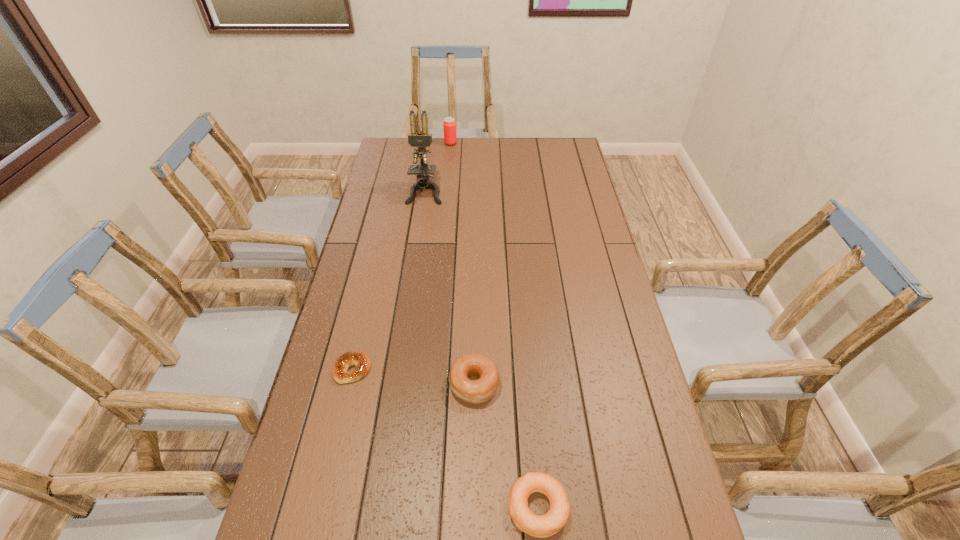
At what (x,y) coordinates should I click in order to perform the action: click on free point between the fourth nearest object and the leftmost bagel. Please return your answer as a coordinate pair (x, y). The width and height of the screenshot is (960, 540). Looking at the image, I should click on (389, 281).

The height and width of the screenshot is (540, 960). I want to click on free spot between the second bagel from right to left and the leftmost bagel, so click(x=414, y=377).

At what (x,y) coordinates should I click in order to perform the action: click on vacant space that's between the beer can and the second farthest object. Please return your answer as a coordinate pair (x, y). This screenshot has width=960, height=540. Looking at the image, I should click on (438, 168).

I want to click on vacant area that lies between the third shortest object and the tallest object, so click(449, 288).

This screenshot has height=540, width=960. I want to click on vacant space that is in between the shortest object and the third tallest object, so click(x=414, y=377).

Choose which object is the fourth nearest neighbor to the farthest object. Please provide its 2D coordinates. Your answer should be formatted as a tuple, i.e. [(x, y)], where the tuple contains the x and y coordinates of a point satisfying the conditions above.

[(541, 526)]

Identify the location of object that is the second closest to the fourth shortest object. (360, 359).

The width and height of the screenshot is (960, 540). I want to click on bagel object that ranks as the second closest to the second object from right to left, so click(360, 359).

Locate an element on the screen. The height and width of the screenshot is (540, 960). bagel that is the second closest to the shortest bagel is located at coordinates (541, 526).

You are a GUI agent. You are given a task and a screenshot of the screen. Output one action in this format:
    pyautogui.click(x=<x>, y=<y>)
    Task: Click on the free space in the image that satisfies the following two spatial constraints: 1. at the eyepieces of the second farthest object; 2. on the left side of the third shortest object
    This screenshot has height=540, width=960.
    Given the screenshot: What is the action you would take?
    pyautogui.click(x=396, y=384)